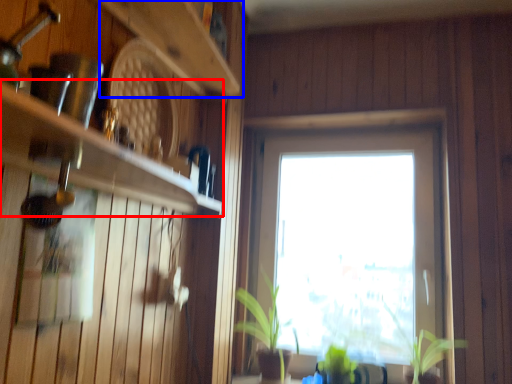
Question: Which object appears closest to the camera in this image, shelf (highlighted by a red box) or shelf (highlighted by a blue box)?

Choices:
 (A) shelf
 (B) shelf

Answer: (A)